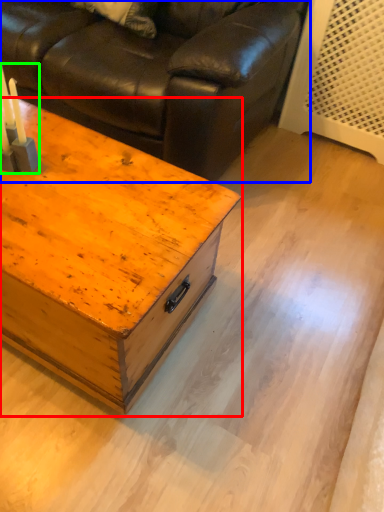
Question: Based on their relative distances, which object is nearer to table (highlighted by a red box)? Choose from studio couch (highlighted by a blue box) and candle holder (highlighted by a green box).

Choices:
 (A) studio couch
 (B) candle holder

Answer: (B)